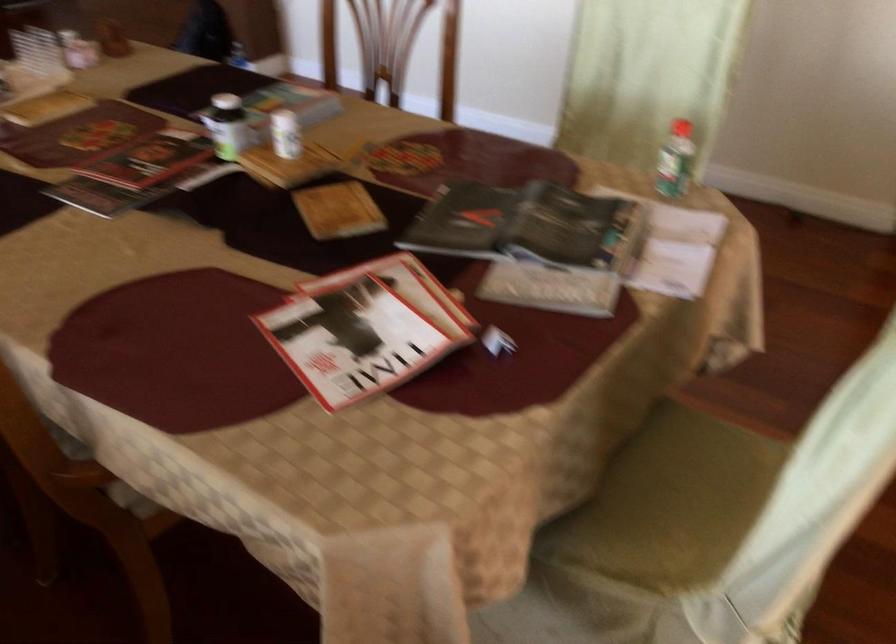
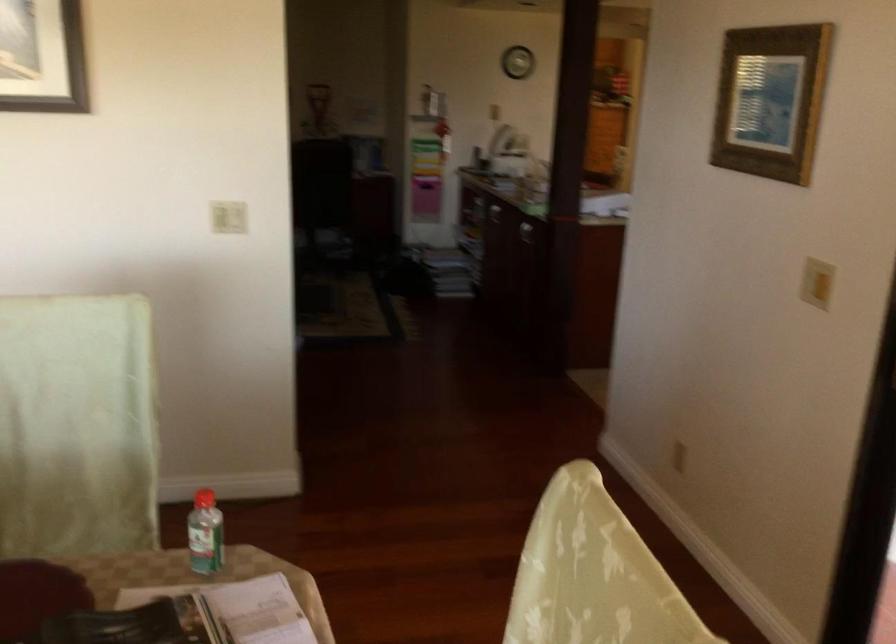
Question: Based on the continuous images, in which direction is the camera rotating? Reply with the corresponding letter.

Choices:
 (A) Left
 (B) Right
 (C) Up
 (D) Down

Answer: (B)